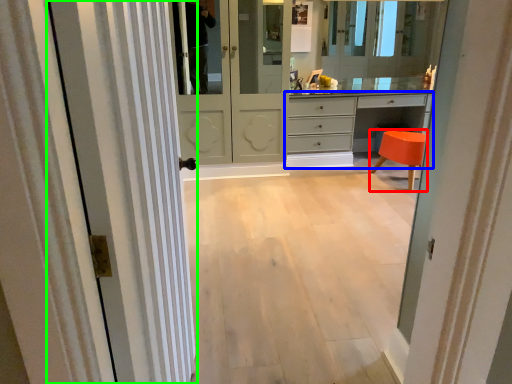
Question: Estimate the real-world distances between objects in this image. Which object is farther from stool (highlighted by a red box), chest of drawers (highlighted by a blue box) or door (highlighted by a green box)?

Choices:
 (A) chest of drawers
 (B) door

Answer: (B)